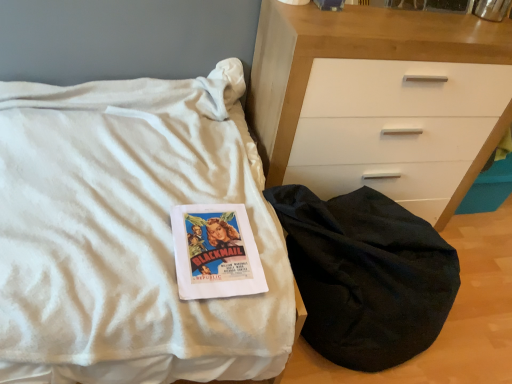
Question: From a real-world perspective, is black fabric sleeping bag at lower right positioned over white matte chest of drawers at center based on gravity?

Choices:
 (A) yes
 (B) no

Answer: (B)

Question: From the image's perspective, is black fabric sleeping bag at lower right over white matte chest of drawers at center?

Choices:
 (A) no
 (B) yes

Answer: (A)

Question: Can you confirm if black fabric sleeping bag at lower right is bigger than white matte chest of drawers at center?

Choices:
 (A) yes
 (B) no

Answer: (B)

Question: Does black fabric sleeping bag at lower right appear on the left side of white matte chest of drawers at center?

Choices:
 (A) yes
 (B) no

Answer: (A)

Question: From a real-world perspective, is black fabric sleeping bag at lower right located beneath white matte chest of drawers at center?

Choices:
 (A) no
 (B) yes

Answer: (B)

Question: From a real-world perspective, is black fabric sleeping bag at lower right above or below white soft blanket at center?

Choices:
 (A) above
 (B) below

Answer: (B)

Question: Is black fabric sleeping bag at lower right bigger or smaller than white soft blanket at center?

Choices:
 (A) big
 (B) small

Answer: (B)

Question: Considering the relative positions of black fabric sleeping bag at lower right and white soft blanket at center in the image provided, is black fabric sleeping bag at lower right to the left or to the right of white soft blanket at center?

Choices:
 (A) left
 (B) right

Answer: (B)

Question: Is black fabric sleeping bag at lower right taller or shorter than white soft blanket at center?

Choices:
 (A) short
 (B) tall

Answer: (A)

Question: From a real-world perspective, is white matte chest of drawers at center above or below white soft blanket at center?

Choices:
 (A) above
 (B) below

Answer: (A)

Question: Considering their positions, is white matte chest of drawers at center located in front of or behind white soft blanket at center?

Choices:
 (A) behind
 (B) front

Answer: (A)

Question: From their relative heights in the image, would you say white matte chest of drawers at center is taller or shorter than white soft blanket at center?

Choices:
 (A) tall
 (B) short

Answer: (A)

Question: From the image's perspective, is white matte chest of drawers at center located above or below white soft blanket at center?

Choices:
 (A) above
 (B) below

Answer: (A)

Question: Is white matte chest of drawers at center bigger or smaller than black fabric sleeping bag at lower right?

Choices:
 (A) small
 (B) big

Answer: (B)

Question: Is white matte chest of drawers at center taller or shorter than black fabric sleeping bag at lower right?

Choices:
 (A) tall
 (B) short

Answer: (A)